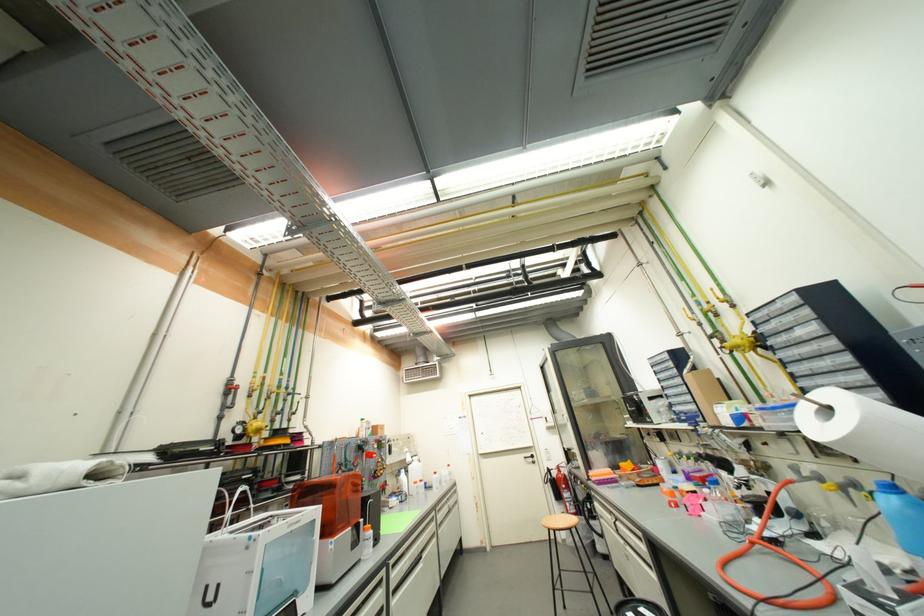
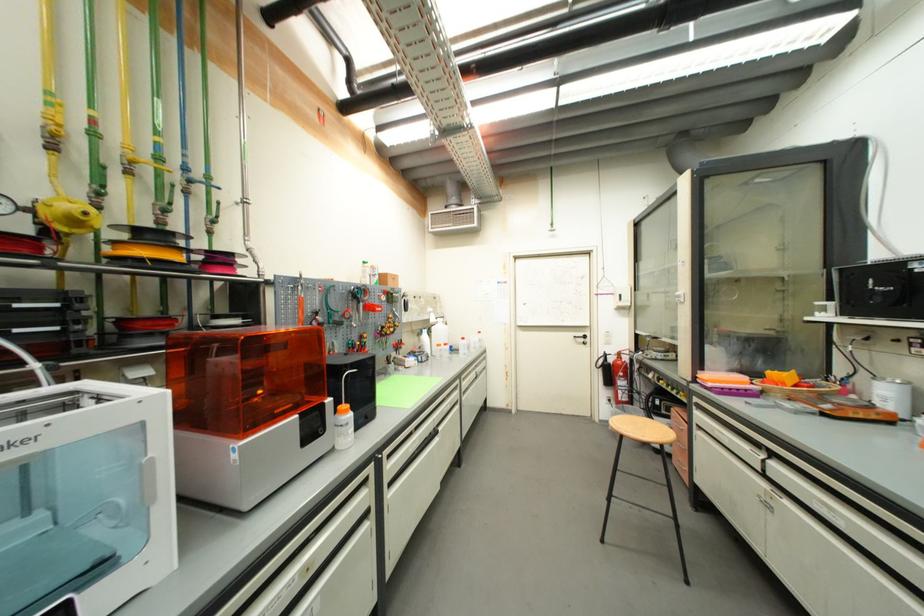
Where in the second image is the point corresponding to the point at 593,477 from the first image?

(699, 379)